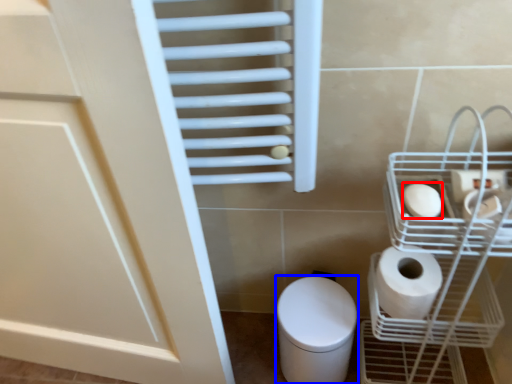
Question: Which object is further to the camera taking this photo, toilet paper (highlighted by a red box) or bidet (highlighted by a blue box)?

Choices:
 (A) toilet paper
 (B) bidet

Answer: (B)